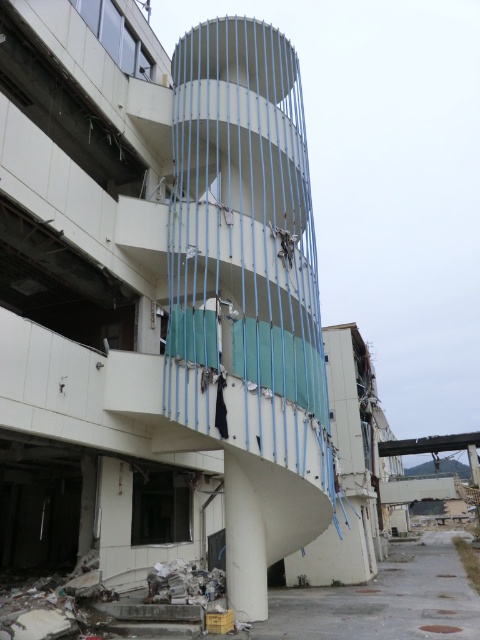
You are a construction worker assessing the site. You see the white plastic scaffolding at center and the broken concrete rubble at lower center. Which object is closer to you?

The white plastic scaffolding at center is further away than the broken concrete rubble at lower center, so the broken concrete rubble at lower center is closer to you.

You are a construction worker assessing the site. You see the white plastic scaffolding at center and the broken concrete rubble at lower center. Which object is positioned to the right of the other?

The white plastic scaffolding at center is to the right of broken concrete rubble at lower center.

Looking at this image, you are a drone operator tasked with inspecting the damaged building. You have two points marked on your screen, point A at coordinates point [312,348] and point B at coordinates point [192,593]. Which point is closer to the drone camera lens?

Point A at coordinates point [312,348] is closer to the drone camera lens because it is further to the viewer than point B at coordinates point [192,593].